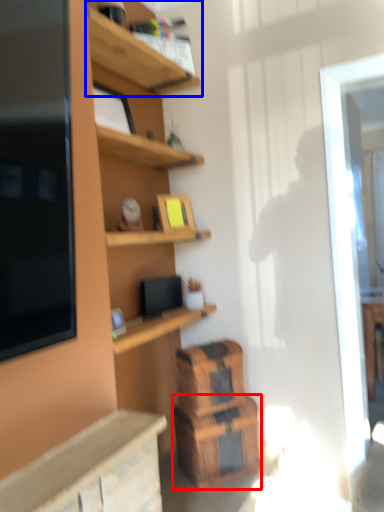
Question: Which point is closer to the camera, crate (highlighted by a red box) or shelf (highlighted by a blue box)?

Choices:
 (A) crate
 (B) shelf

Answer: (A)